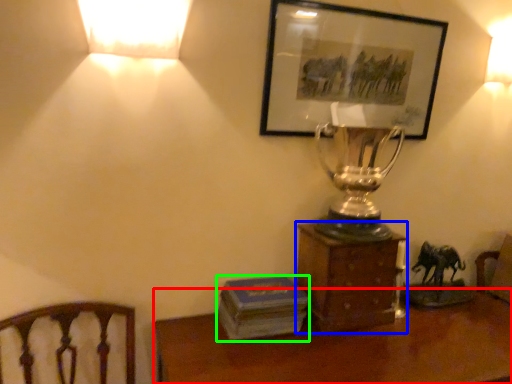
Question: Which object is positioned closest to desk (highlighted by a red box)? Select from furniture (highlighted by a blue box) and paperback book (highlighted by a green box).

Choices:
 (A) furniture
 (B) paperback book

Answer: (B)